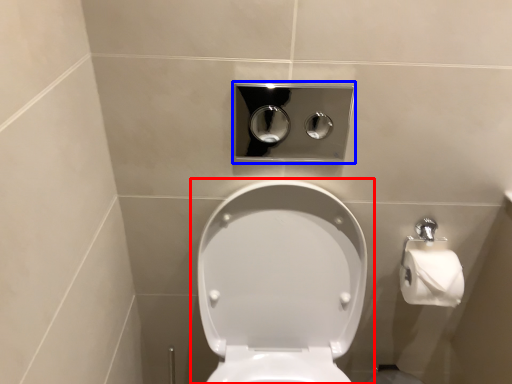
Question: Among these objects, which one is nearest to the camera, toilet (highlighted by a red box) or dispenser (highlighted by a blue box)?

Choices:
 (A) toilet
 (B) dispenser

Answer: (A)